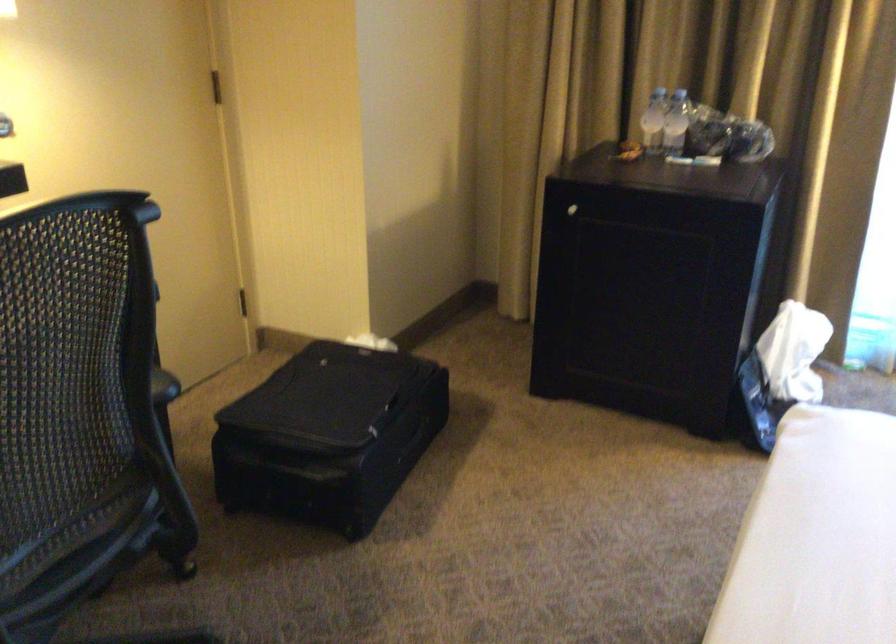
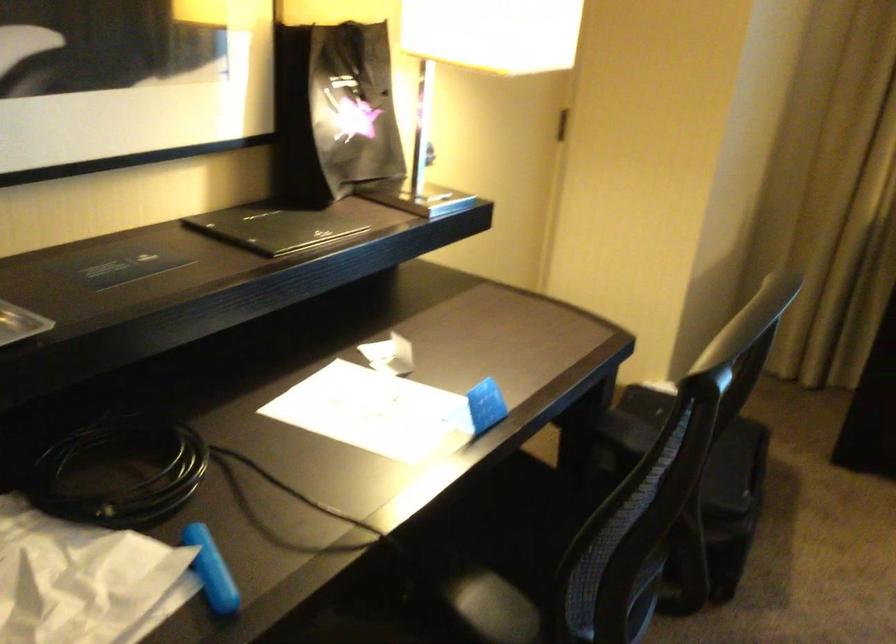
Question: How did the camera likely rotate?

Choices:
 (A) Left
 (B) Right
 (C) Up
 (D) Down

Answer: (A)